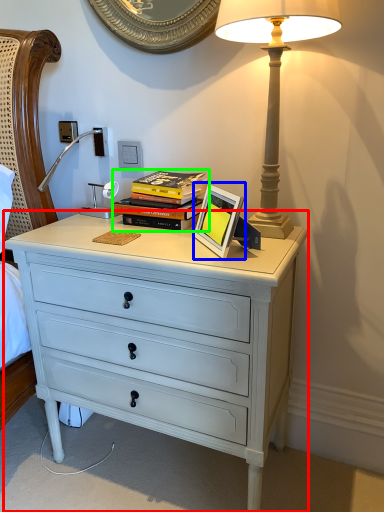
Question: Considering the real-world distances, which object is closest to chest of drawers (highlighted by a red box)? picture frame (highlighted by a blue box) or book (highlighted by a green box).

Choices:
 (A) picture frame
 (B) book

Answer: (A)